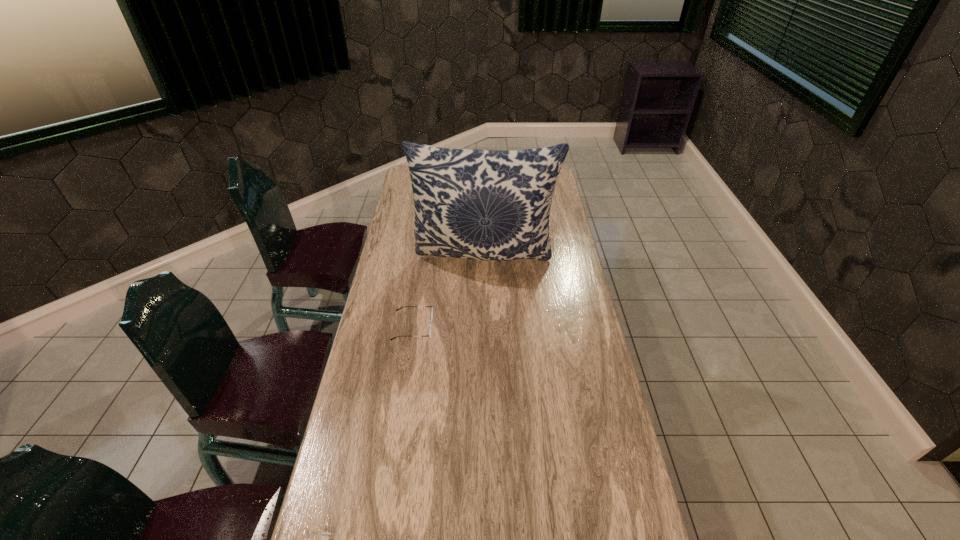
Where is `vacant space at the right edge of the desktop`? The image size is (960, 540). vacant space at the right edge of the desktop is located at coordinates (556, 198).

Image resolution: width=960 pixels, height=540 pixels. Identify the location of vacant space at the far left corner of the desktop. (408, 180).

You are a GUI agent. You are given a task and a screenshot of the screen. Output one action in this format:
    pyautogui.click(x=<x>, y=<y>)
    Task: Click on the empty location between the second farthest object and the tallest object
    The height and width of the screenshot is (540, 960).
    Given the screenshot: What is the action you would take?
    pyautogui.click(x=448, y=293)

Image resolution: width=960 pixels, height=540 pixels. What are the coordinates of `free spot between the second shortest object and the tallest object` in the screenshot? It's located at (448, 293).

Select which object appears as the second closest to the second farthest object. Please provide its 2D coordinates. Your answer should be formatted as a tuple, i.e. [(x, y)], where the tuple contains the x and y coordinates of a point satisfying the conditions above.

[(325, 539)]

At what (x,y) coordinates should I click in order to perform the action: click on object that ranks as the second closest to the second nearest object. Please return your answer as a coordinate pair (x, y). This screenshot has height=540, width=960. Looking at the image, I should click on (325, 539).

Identify the location of free location that satisfies the following two spatial constraints: 1. on the front surface of the cushion; 2. on the lenses of the second farthest object. The image size is (960, 540). (486, 327).